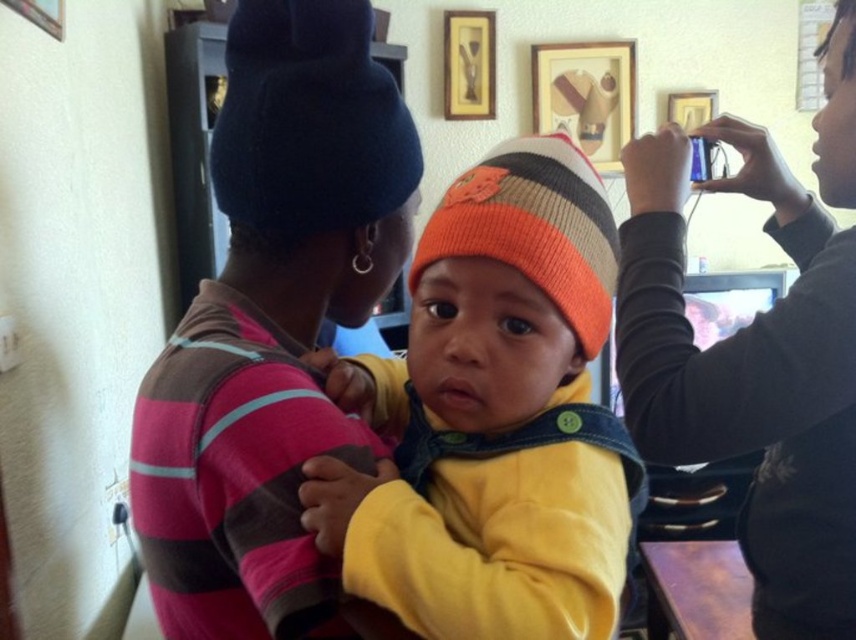
Consider the image. Can you confirm if matte black beanie at upper center is shorter than knitted orange beanie at center?

No, matte black beanie at upper center is not shorter than knitted orange beanie at center.

Is point (272, 340) farther from camera compared to point (421, 348)?

Yes, it is behind point (421, 348).

Find the location of `matte black beanie at upper center`. matte black beanie at upper center is located at coordinates (274, 332).

Is knitted orange beanie at center further to the viewer compared to orange striped knit beanie at center?

No, knitted orange beanie at center is closer to the viewer.

Who is more forward, (490, 232) or (550, 225)?

Positioned in front is point (490, 232).

Identify the location of knitted orange beanie at center. The image size is (856, 640). (492, 417).

Is black matte phone at upper right below black woolen beanie at upper center?

Yes, black matte phone at upper right is below black woolen beanie at upper center.

Image resolution: width=856 pixels, height=640 pixels. What do you see at coordinates (750, 376) in the screenshot?
I see `black matte phone at upper right` at bounding box center [750, 376].

Where is `black matte phone at upper right`? This screenshot has height=640, width=856. black matte phone at upper right is located at coordinates (750, 376).